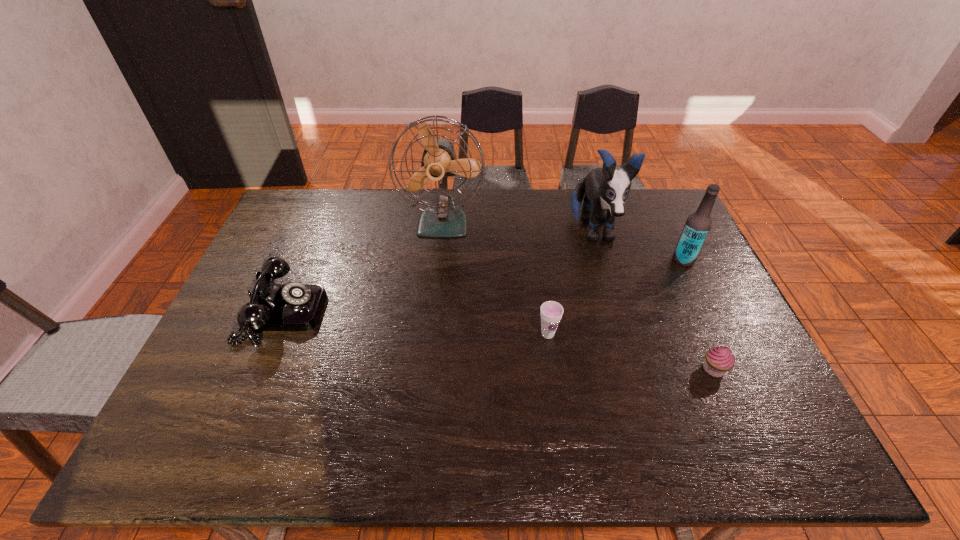
The height and width of the screenshot is (540, 960). I want to click on the second object from left to right, so click(443, 218).

What are the coordinates of `puppy` in the screenshot? It's located at (606, 189).

In order to click on beer bottle in this screenshot , I will do `click(698, 224)`.

You are a GUI agent. You are given a task and a screenshot of the screen. Output one action in this format:
    pyautogui.click(x=<x>, y=<y>)
    Task: Click on the telephone
    Image resolution: width=960 pixels, height=540 pixels.
    Given the screenshot: What is the action you would take?
    pos(294,306)

Find the location of `the third shortest object`. the third shortest object is located at coordinates (294, 306).

Where is `the fourth object from right to left`? the fourth object from right to left is located at coordinates (551, 312).

Where is `the nearest object`? the nearest object is located at coordinates (718, 360).

Locate an element on the screen. The width and height of the screenshot is (960, 540). vacant space situated on the front-facing side of the fan for air flow is located at coordinates (436, 307).

You are a GUI agent. You are given a task and a screenshot of the screen. Output one action in this format:
    pyautogui.click(x=<x>, y=<y>)
    Task: Click on the free region located on the front-facing side of the third object from right to left
    
    Given the screenshot: What is the action you would take?
    pyautogui.click(x=612, y=298)

Identify the location of vacant space located on the label of the beer bottle. The height and width of the screenshot is (540, 960). (606, 260).